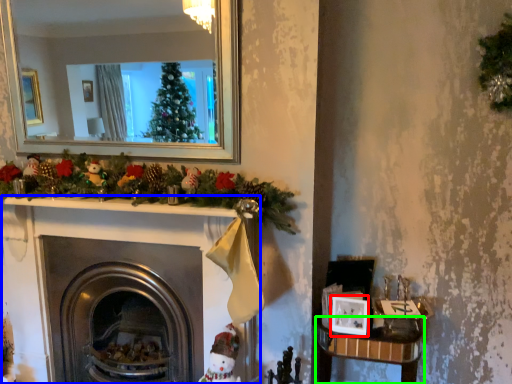
Question: Which is nearer to the picture frame (highlighted by a red box)? fireplace (highlighted by a blue box) or table (highlighted by a green box).

Choices:
 (A) fireplace
 (B) table

Answer: (B)